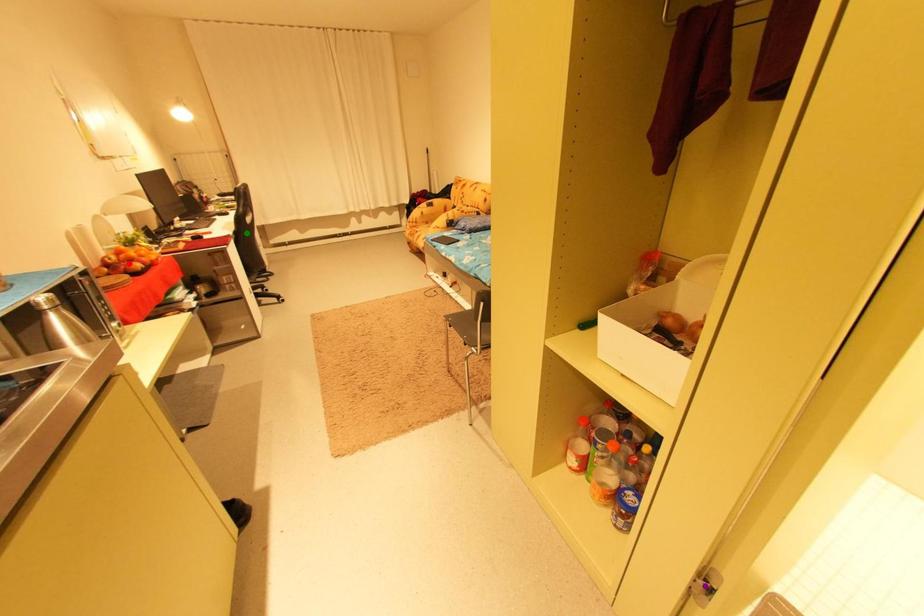
Order these from nearest to farthest:
- red point
- purple point
- green point

purple point
red point
green point